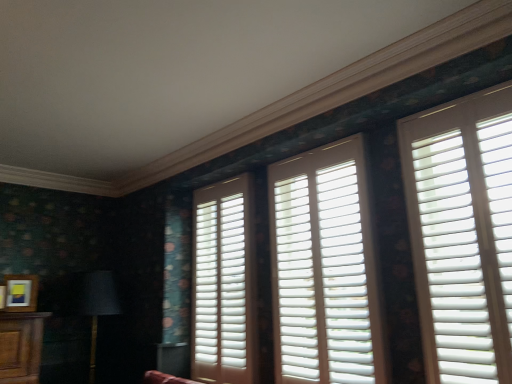
Question: Considering the relative sizes of matte wooden picture frame at lower left and white matte shutters at right, arranged as the third window when viewed from the left, in the image provided, is matte wooden picture frame at lower left bigger than white matte shutters at right, arranged as the third window when viewed from the left,?

Choices:
 (A) no
 (B) yes

Answer: (A)

Question: From a real-world perspective, is matte wooden picture frame at lower left over white matte shutters at right, acting as the first window starting from the right?

Choices:
 (A) no
 (B) yes

Answer: (A)

Question: From a real-world perspective, is matte wooden picture frame at lower left located beneath white matte shutters at right, acting as the first window starting from the right?

Choices:
 (A) no
 (B) yes

Answer: (B)

Question: Considering the relative positions of matte wooden picture frame at lower left and white matte shutters at right, acting as the first window starting from the right, in the image provided, is matte wooden picture frame at lower left to the left of white matte shutters at right, acting as the first window starting from the right, from the viewer's perspective?

Choices:
 (A) yes
 (B) no

Answer: (A)

Question: Is matte wooden picture frame at lower left shorter than white matte shutters at right, acting as the first window starting from the right?

Choices:
 (A) no
 (B) yes

Answer: (B)

Question: Is the position of matte wooden picture frame at lower left less distant than that of white matte shutters at right, arranged as the third window when viewed from the left?

Choices:
 (A) no
 (B) yes

Answer: (A)

Question: Is matte black lampshade at left placed right next to white matte shutters at right, arranged as the third window when viewed from the left?

Choices:
 (A) no
 (B) yes

Answer: (A)

Question: From the image's perspective, does matte black lampshade at left appear lower than white matte shutters at right, acting as the first window starting from the right?

Choices:
 (A) yes
 (B) no

Answer: (A)

Question: Would you consider matte black lampshade at left to be distant from white matte shutters at right, arranged as the third window when viewed from the left?

Choices:
 (A) no
 (B) yes

Answer: (B)

Question: Does matte black lampshade at left have a greater height compared to white matte shutters at right, arranged as the third window when viewed from the left?

Choices:
 (A) no
 (B) yes

Answer: (A)

Question: Is matte black lampshade at left shorter than white matte shutters at right, acting as the first window starting from the right?

Choices:
 (A) no
 (B) yes

Answer: (B)

Question: Is matte black lampshade at left smaller than white matte shutters at right, acting as the first window starting from the right?

Choices:
 (A) no
 (B) yes

Answer: (A)

Question: Can we say white matte shutters at right, arranged as the third window when viewed from the left, lies outside matte black lampshade at left?

Choices:
 (A) yes
 (B) no

Answer: (A)